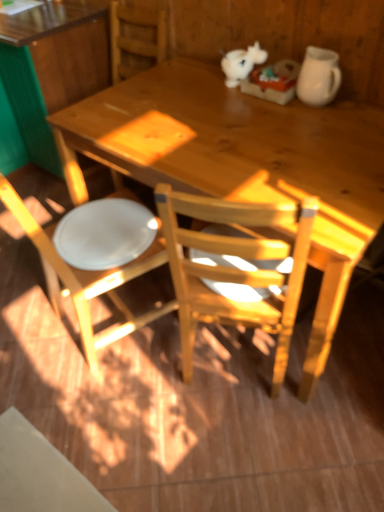
The image size is (384, 512). I want to click on free space above white glossy plate at lower left (from a real-world perspective), so click(x=105, y=218).